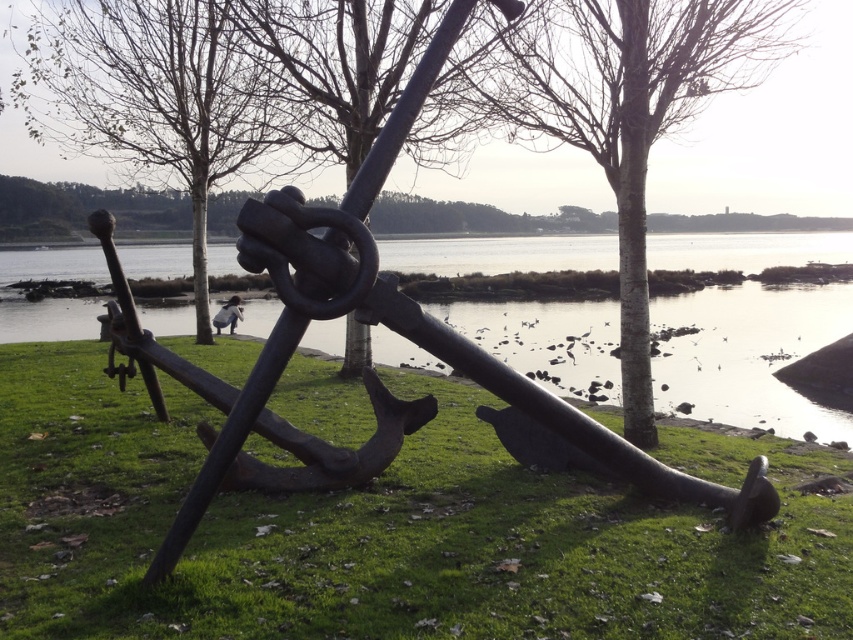
Question: Is green grass at center to the left of brown wood tree at center from the viewer's perspective?

Choices:
 (A) no
 (B) yes

Answer: (A)

Question: Observing the image, what is the correct spatial positioning of glossy metallic water at center in reference to bare wood tree at center?

Choices:
 (A) below
 (B) above

Answer: (A)

Question: Which object is positioned closest to the brown wood tree at center?

Choices:
 (A) green grass at center
 (B) bare wood tree at center
 (C) glossy metallic water at center

Answer: (C)

Question: Which point is closer to the camera?

Choices:
 (A) brown wood tree at center
 (B) glossy metallic water at center
 (C) bare wood tree at center

Answer: (B)

Question: From the image, what is the correct spatial relationship of green grass at center in relation to glossy metallic water at center?

Choices:
 (A) above
 (B) below

Answer: (B)

Question: Which point is farther to the camera?

Choices:
 (A) (90, 35)
 (B) (558, 259)

Answer: (B)